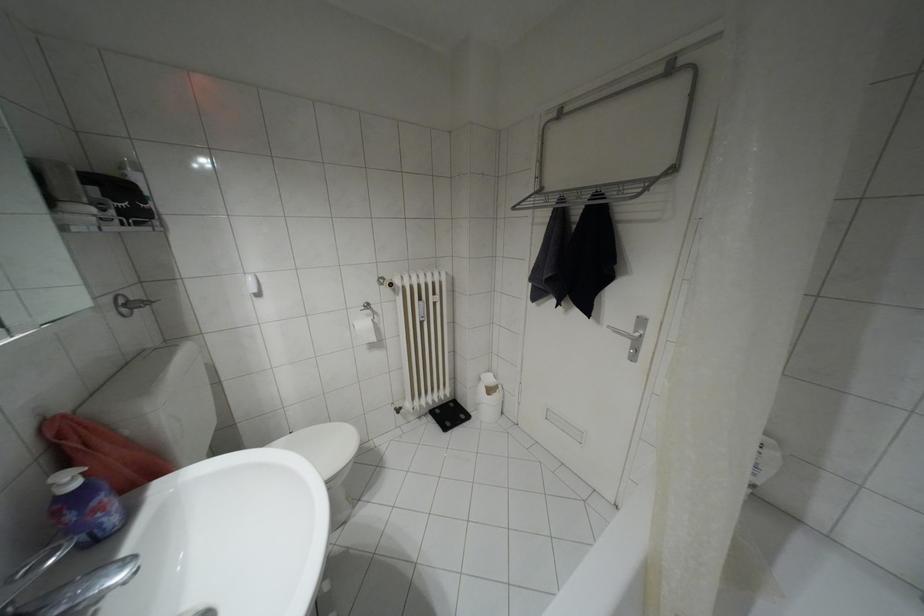
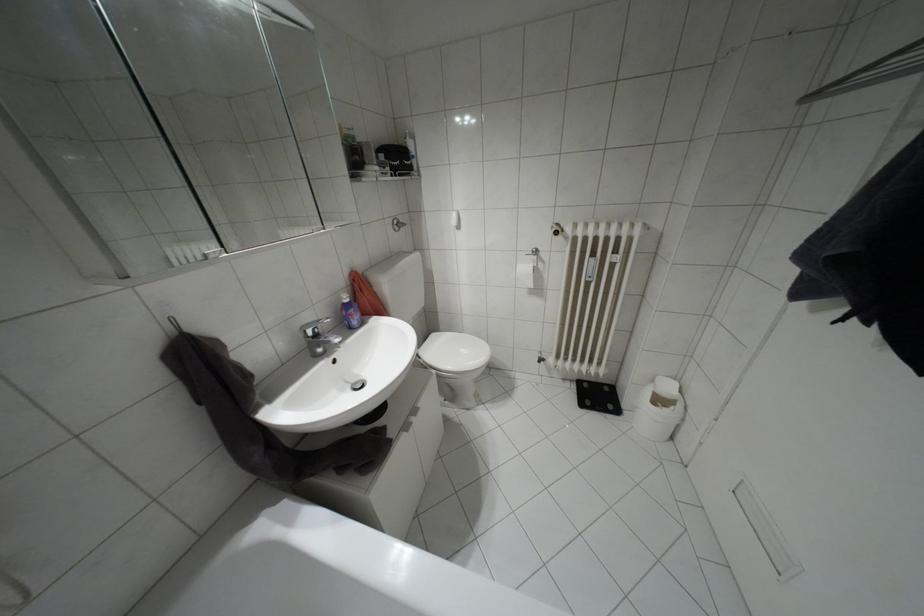
Where in the second image is the point corresponding to point (372, 338) from the first image?

(530, 284)